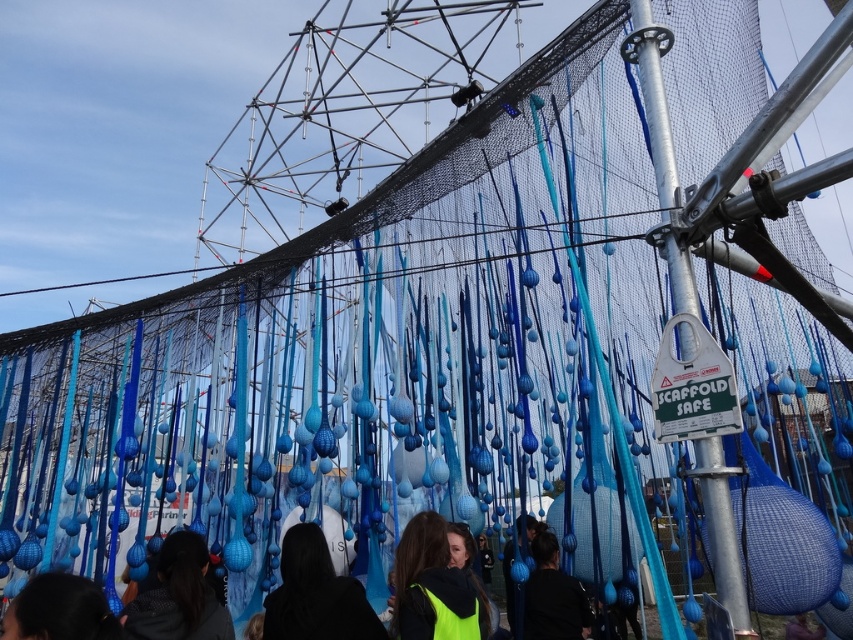
You are an inspector checking the scaffold structure. You notice two points marked on the scaffolding structure at coordinates point (424, 563) and point (809, 627). From your vantage point, which point is closer to you?

Point (424, 563) is in front of point (809, 627), so it is closer to you.

You are an artist planning to hang a new ribbon on the silver metallic pole at center and the matte black hair at lower left. Which object will allow the ribbon to hang more securely?

Result: The matte black hair at lower left will allow the ribbon to hang more securely because it is thicker than the silver metallic pole at center.

You are an artist planning to add a new element to the installation. You have a neon yellow jacket at center and a neon yellow fabric at lower center. Which object should you move to the right to align them horizontally?

You should move the neon yellow fabric at lower center to the right because the neon yellow jacket at center is already positioned to its left, so shifting the fabric right would align them horizontally.